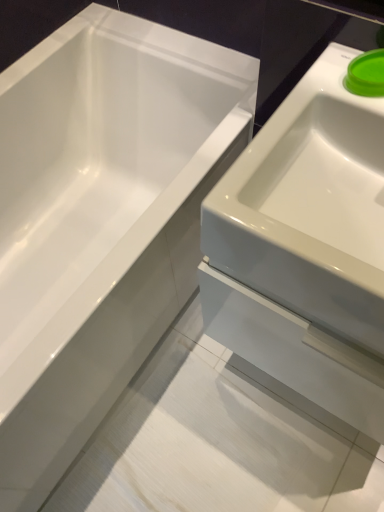
Question: Is white glossy sink at right at the left side of green plastic lid at upper right?

Choices:
 (A) yes
 (B) no

Answer: (B)

Question: Considering the relative sizes of white glossy sink at right and green plastic lid at upper right in the image provided, is white glossy sink at right shorter than green plastic lid at upper right?

Choices:
 (A) yes
 (B) no

Answer: (B)

Question: Is green plastic lid at upper right completely or partially inside white glossy sink at right?

Choices:
 (A) no
 (B) yes

Answer: (A)

Question: Is white glossy sink at right behind green plastic lid at upper right?

Choices:
 (A) no
 (B) yes

Answer: (A)

Question: Is white glossy sink at right to the right of green plastic lid at upper right from the viewer's perspective?

Choices:
 (A) yes
 (B) no

Answer: (A)

Question: Considering the relative sizes of white glossy sink at right and green plastic lid at upper right in the image provided, is white glossy sink at right taller than green plastic lid at upper right?

Choices:
 (A) yes
 (B) no

Answer: (A)

Question: From a real-world perspective, is white glossy sink at right located beneath white glossy bathtub at upper left?

Choices:
 (A) no
 (B) yes

Answer: (A)

Question: From the image's perspective, is white glossy sink at right under white glossy bathtub at upper left?

Choices:
 (A) no
 (B) yes

Answer: (B)

Question: Can you confirm if white glossy sink at right is wider than white glossy bathtub at upper left?

Choices:
 (A) no
 (B) yes

Answer: (A)

Question: Is white glossy sink at right surrounding white glossy bathtub at upper left?

Choices:
 (A) no
 (B) yes

Answer: (A)

Question: Is white glossy sink at right far from white glossy bathtub at upper left?

Choices:
 (A) no
 (B) yes

Answer: (A)

Question: Considering the relative positions of white glossy sink at right and white glossy bathtub at upper left in the image provided, is white glossy sink at right to the left of white glossy bathtub at upper left from the viewer's perspective?

Choices:
 (A) yes
 (B) no

Answer: (B)

Question: From the image's perspective, is green plastic lid at upper right located above white glossy bathtub at upper left?

Choices:
 (A) yes
 (B) no

Answer: (A)